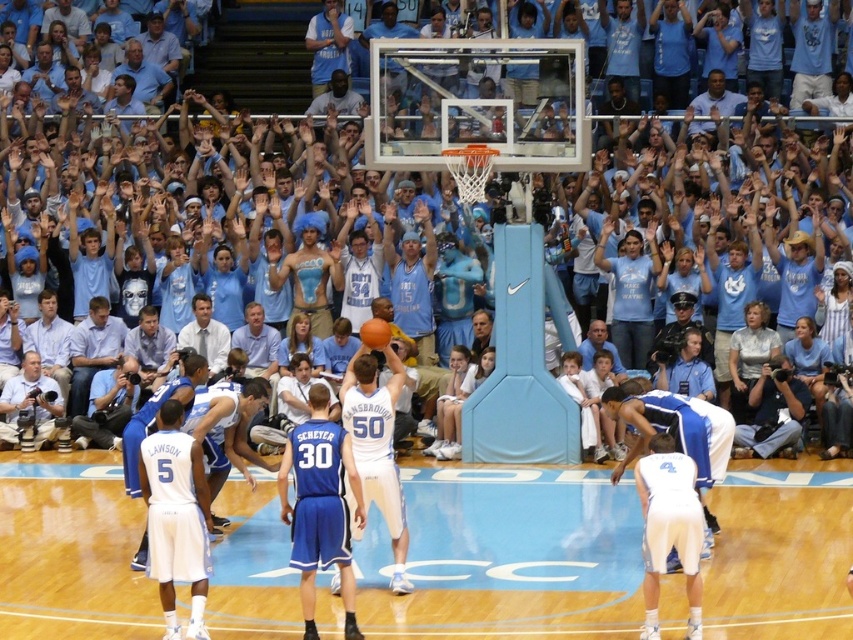
Question: Which point appears closest to the camera in this image?

Choices:
 (A) (204, 316)
 (B) (363, 440)

Answer: (B)

Question: Considering the relative positions of light blue jersey at upper center and orange matte basketball at center in the image provided, where is light blue jersey at upper center located with respect to orange matte basketball at center?

Choices:
 (A) left
 (B) right

Answer: (A)

Question: Does wooden floor at center appear under orange matte basketball at center?

Choices:
 (A) no
 (B) yes

Answer: (B)

Question: Which object is farther from the camera taking this photo?

Choices:
 (A) white matte basketball player at lower right
 (B) wooden floor at center
 (C) white matte basketball at center

Answer: (A)

Question: Can you confirm if wooden floor at center is smaller than light blue jersey at upper center?

Choices:
 (A) no
 (B) yes

Answer: (A)

Question: Which object is positioned farthest from the matte silver camera at lower left?

Choices:
 (A) white matte basketball player at lower right
 (B) white matte basketball at center
 (C) orange matte basketball at center
 (D) blue fabric jacket at lower left

Answer: (A)